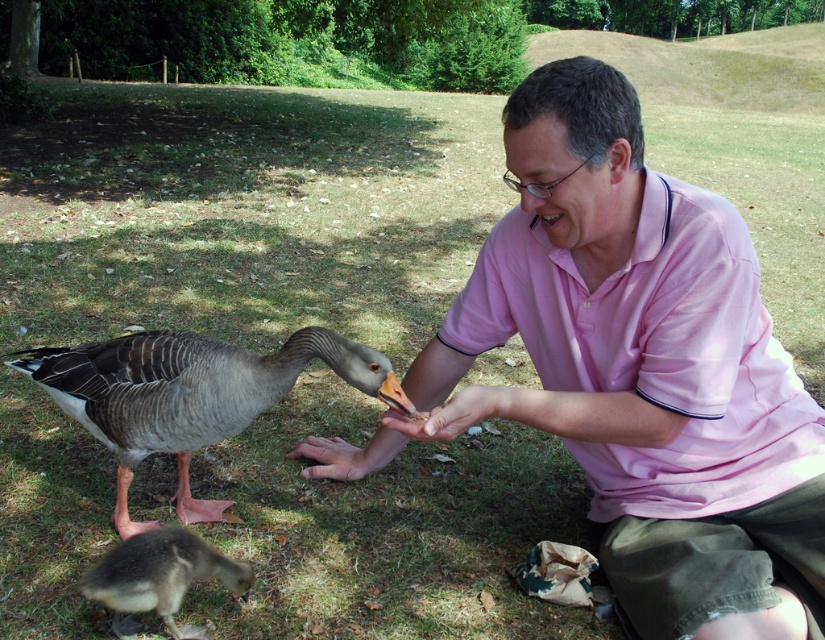
Question: Is gray feathered duck at center thinner than brown leather hand at lower center?

Choices:
 (A) no
 (B) yes

Answer: (A)

Question: Is pink cotton shirt at center thinner than brown leather hand at lower center?

Choices:
 (A) yes
 (B) no

Answer: (B)

Question: Which object is positioned farthest from the gray downy duckling at lower left?

Choices:
 (A) brown leather hand at lower center
 (B) matte skin hand at center

Answer: (A)

Question: Which point appears farthest from the camera in this image?

Choices:
 (A) (727, 544)
 (B) (324, 449)
 (C) (192, 628)

Answer: (B)

Question: Is gray feathered duck at center to the left of brown leather hand at lower center from the viewer's perspective?

Choices:
 (A) no
 (B) yes

Answer: (B)

Question: Among these points, which one is farthest from the camera?

Choices:
 (A) (439, 406)
 (B) (517, 273)
 (C) (346, 452)
 (D) (137, 332)

Answer: (D)